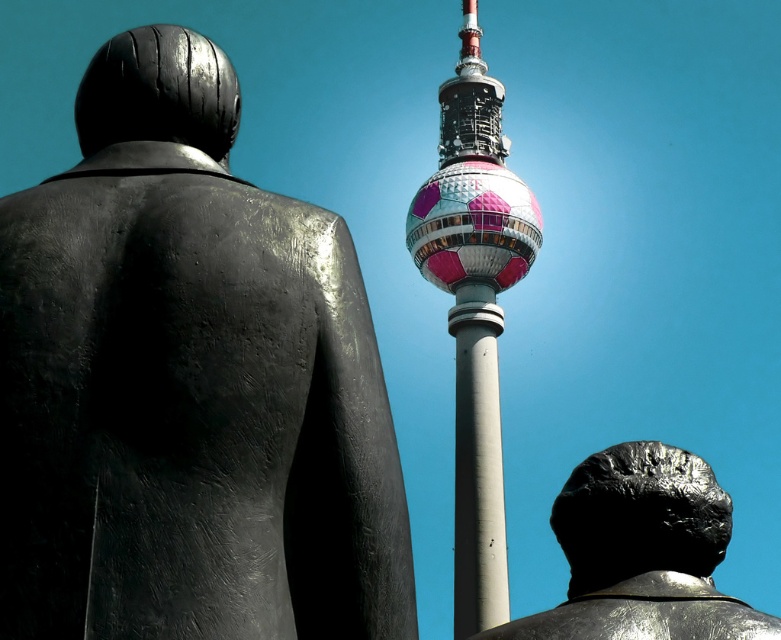
You are an architect designing a new plaza and want to place a new bench between the matte black statue at left and the shiny metallic tower at center. The bench requires a minimum of 2 meters of space. Can you fit the bench between them based on their widths?

The matte black statue at left is narrower than the shiny metallic tower at center, but the description does not provide specific measurements of their widths. Therefore, it is uncertain if there is enough space to fit a 2 meter bench between them.

You are standing in the scene and want to take a photo of the shiny metallic tower at center. Where should you position yourself to ensure the tower is centered in your camera viewfinder?

To center the shiny metallic tower at center in your camera viewfinder, position yourself directly in front of the tower at point (473,308).